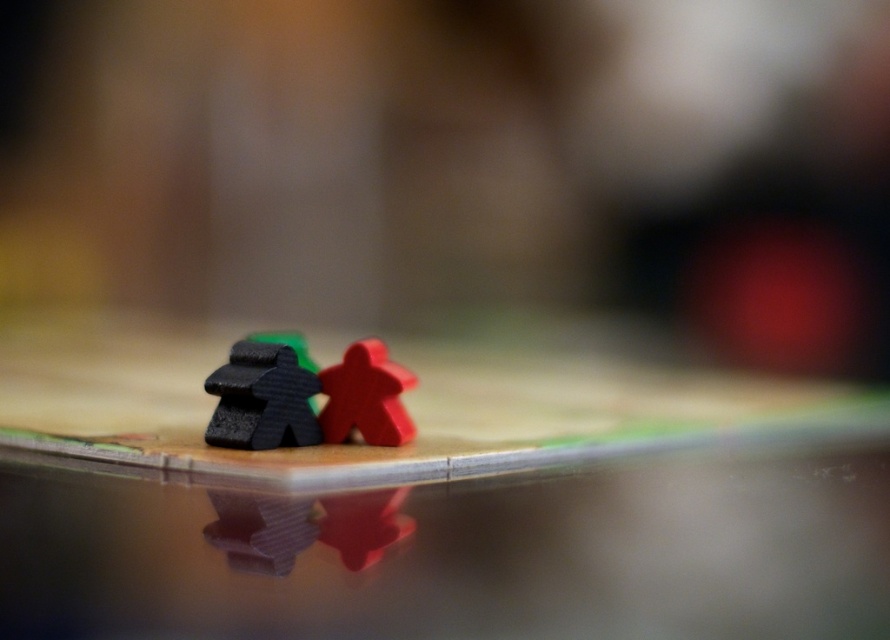
Question: Which point appears farthest from the camera in this image?

Choices:
 (A) (306, 509)
 (B) (360, 362)

Answer: (B)

Question: From the image, what is the correct spatial relationship of matte red meeple at lower center in relation to matte black meeples at center?

Choices:
 (A) above
 (B) below

Answer: (B)

Question: Among these objects, which one is farthest from the camera?

Choices:
 (A) wooden board game pieces at center
 (B) matte plastic meeples at center
 (C) matte red meeple at lower center
 (D) matte black meeples at center

Answer: (B)

Question: Does matte red meeple at lower center appear on the left side of matte black meeples at center?

Choices:
 (A) yes
 (B) no

Answer: (B)

Question: Which point is farther to the camera?

Choices:
 (A) (368, 552)
 (B) (366, 426)

Answer: (B)

Question: Does wooden board game pieces at center come behind matte red meeple at lower center?

Choices:
 (A) yes
 (B) no

Answer: (B)